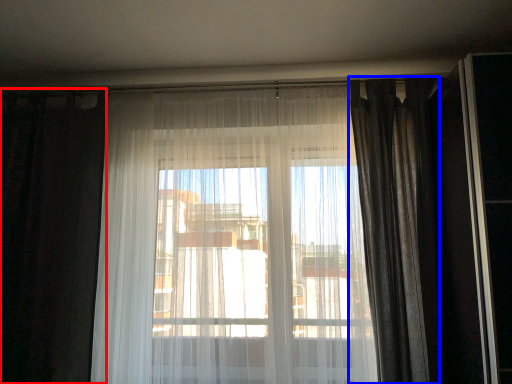
Question: Which object appears closest to the camera in this image, curtain (highlighted by a red box) or curtain (highlighted by a blue box)?

Choices:
 (A) curtain
 (B) curtain

Answer: (B)